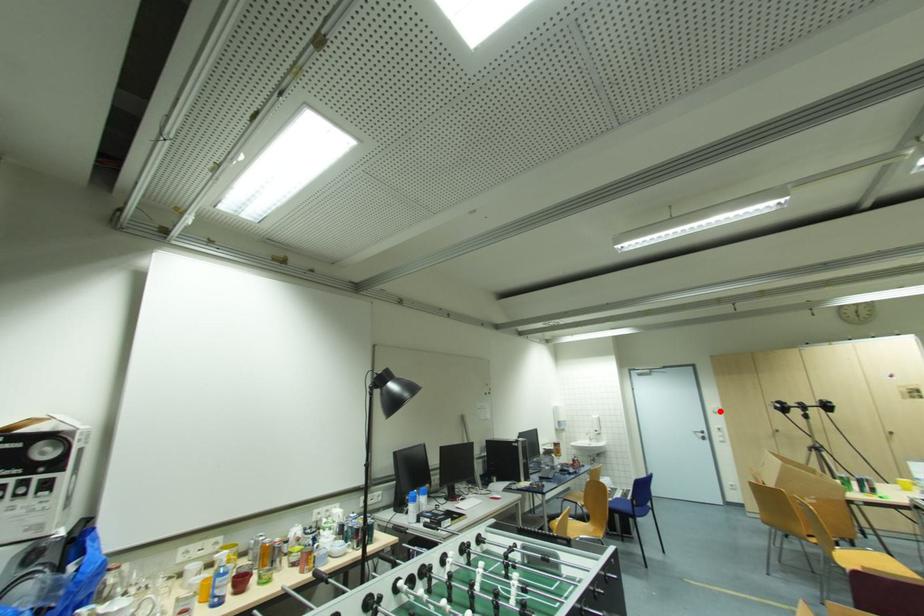
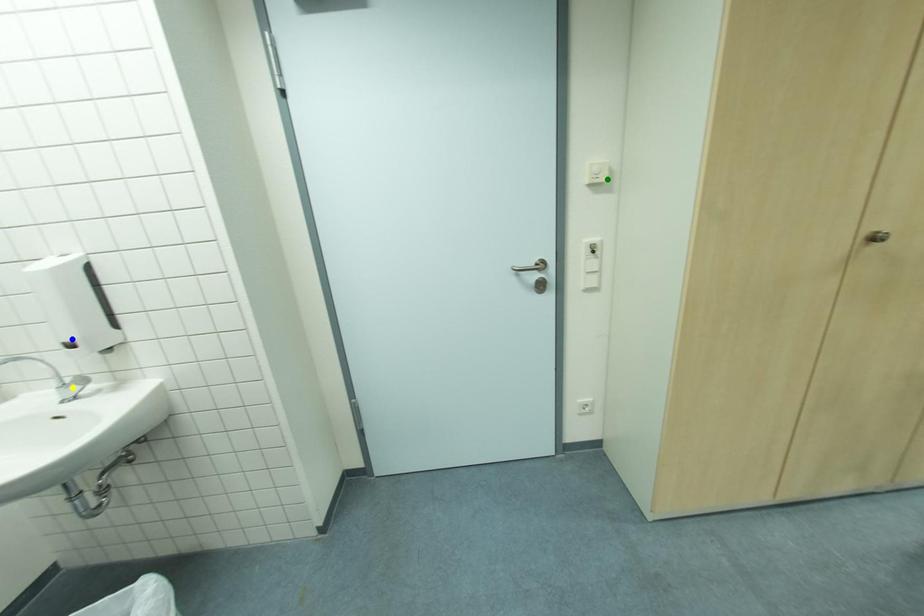
Question: I am providing you with two images of the same scene from different viewpoints. A red point is marked on the first image. You are given multiple points on the second image. Which point in image 2 represents the same 3d spot as the red point in image 1?

Choices:
 (A) blue point
 (B) yellow point
 (C) green point

Answer: (C)